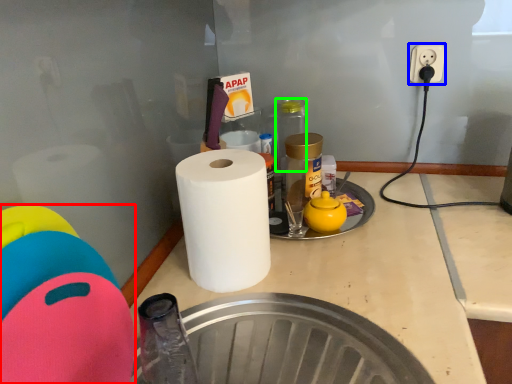
Question: Which object is the farthest from toy (highlighted by a red box)? Choose among these: electric outlet (highlighted by a blue box) or bottle (highlighted by a green box).

Choices:
 (A) electric outlet
 (B) bottle

Answer: (A)